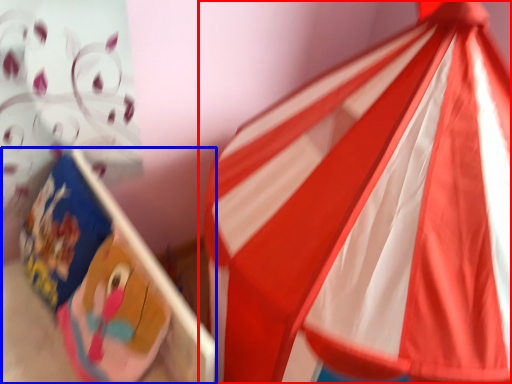
Question: Which object is further to the camera taking this photo, flag (highlighted by a red box) or cardboard box (highlighted by a blue box)?

Choices:
 (A) flag
 (B) cardboard box

Answer: (B)